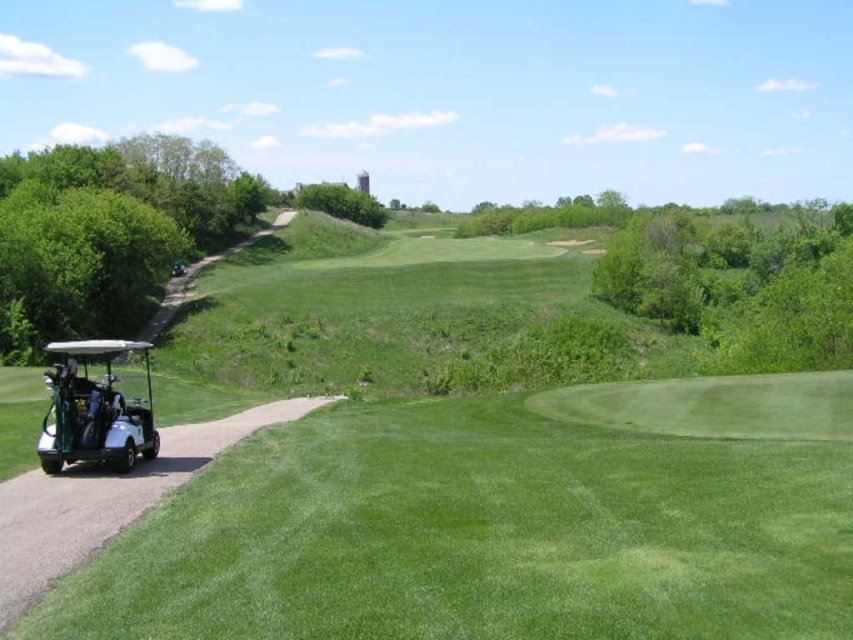
Question: Which of the following is the farthest from the observer?

Choices:
 (A) (90, 460)
 (B) (685, 435)

Answer: (B)

Question: Is white matte golf cart at left above white matte golf cart at lower left?

Choices:
 (A) no
 (B) yes

Answer: (B)

Question: Which object appears farthest from the camera in this image?

Choices:
 (A) white matte golf cart at left
 (B) white matte golf cart at lower left

Answer: (B)

Question: Which point is closer to the camera?

Choices:
 (A) (468, 456)
 (B) (76, 452)

Answer: (B)

Question: Does white matte golf cart at left have a lesser width compared to white matte golf cart at lower left?

Choices:
 (A) yes
 (B) no

Answer: (B)

Question: Is white matte golf cart at left to the right of white matte golf cart at lower left from the viewer's perspective?

Choices:
 (A) yes
 (B) no

Answer: (A)